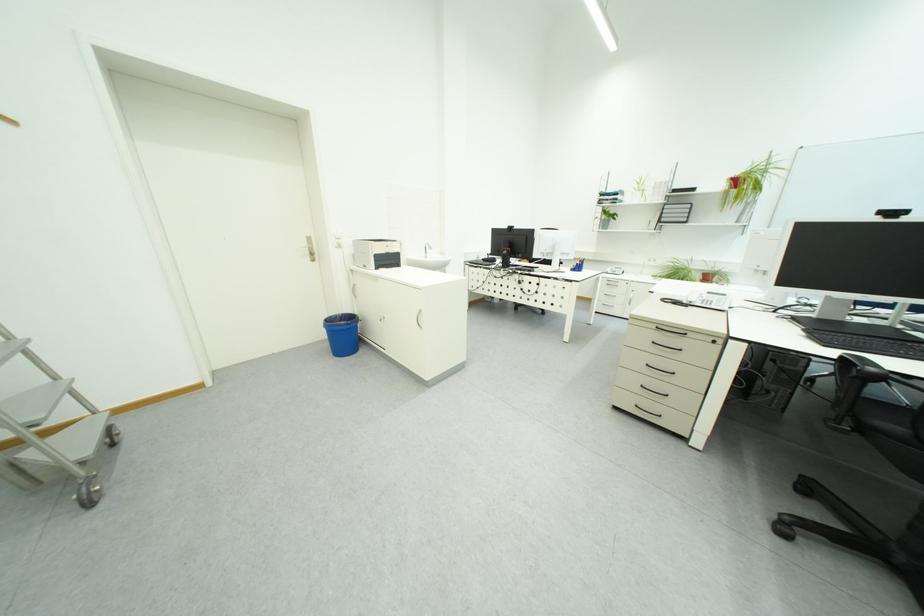
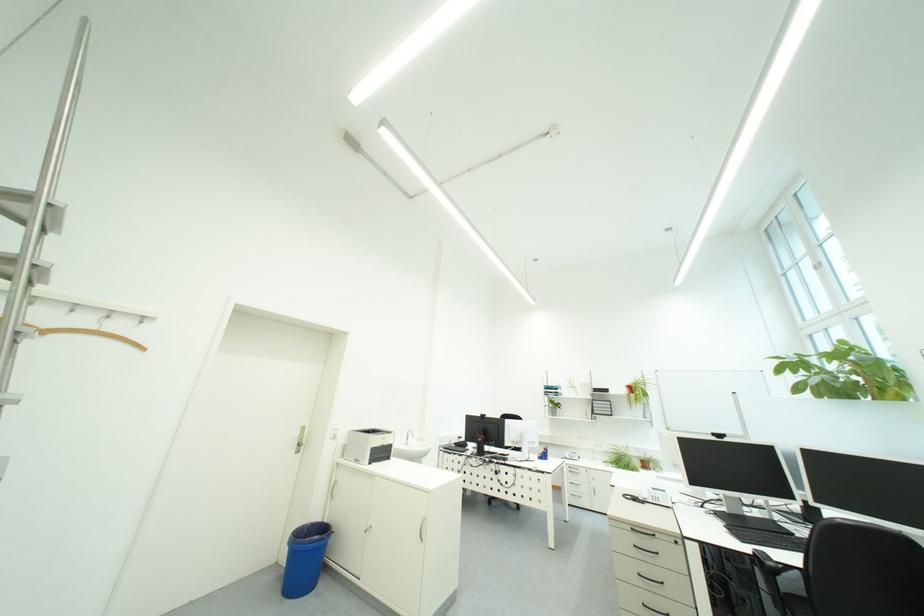
Question: How did the camera likely rotate?

Choices:
 (A) Left
 (B) Right
 (C) Up
 (D) Down

Answer: (C)